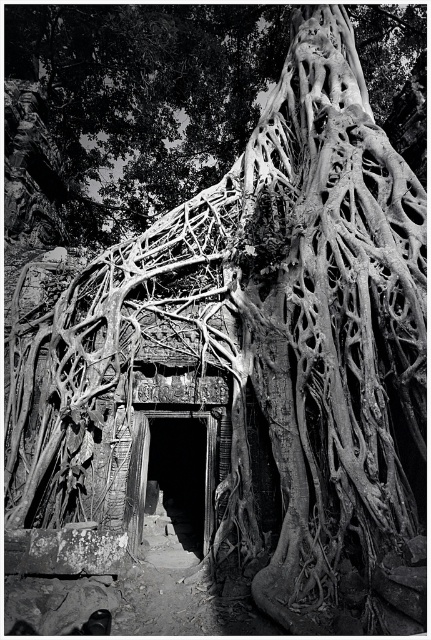
From the picture: You are an archaeologist examining the ancient structure. You notice the rough bark roots at center and the dark stone doorway at center. Which object takes up more space in the image?

The rough bark roots at center is larger in size than the dark stone doorway at center, so the rough bark roots at center takes up more space in the image.

You are an archaeologist examining the ancient structure. You notice the rough bark roots at center and the dark stone doorway at center. Which object is taller in this scene?

The rough bark roots at center are taller than the dark stone doorway at center.